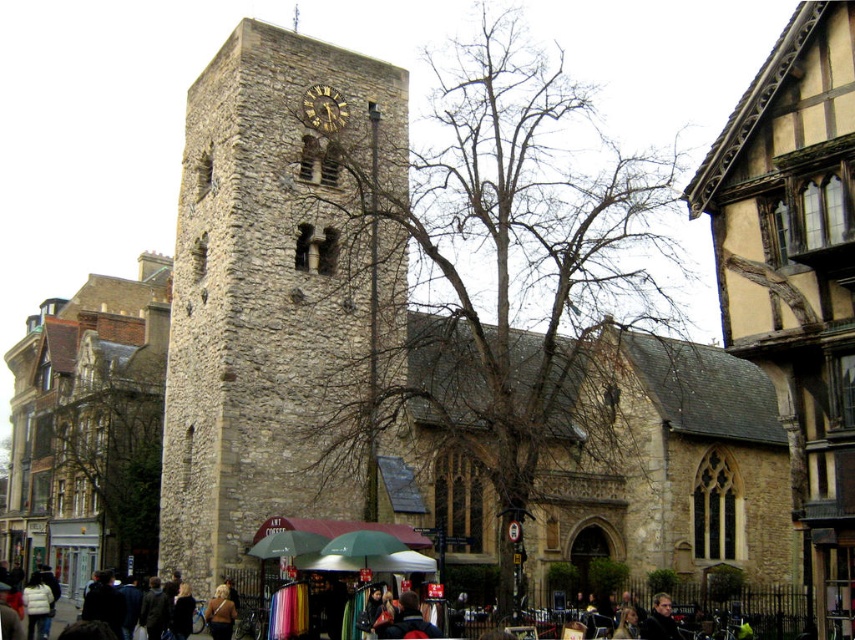
You are a tourist standing in front of the historic stone church. You notice the golden hair at lower center and the stone tower at center. Which object is closer to you?

The stone tower at center is closer to you than the golden hair at lower center because the golden hair at lower center is behind the stone tower at center.

You are standing in the market area in front of the historic stone church. There is a point marked at coordinates (87, 428). Which object does this point correspond to?

The point at coordinates (87, 428) corresponds to the stone tower at center.